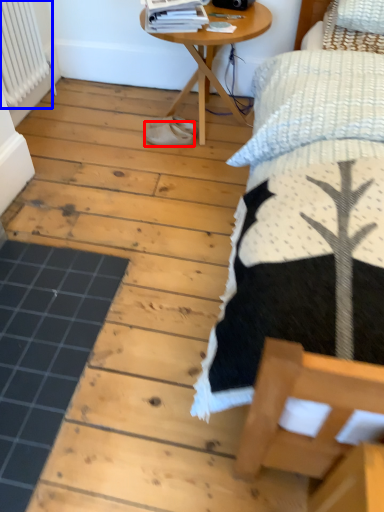
Question: Which point is closer to the camera, footwear (highlighted by a red box) or radiator (highlighted by a blue box)?

Choices:
 (A) footwear
 (B) radiator

Answer: (B)